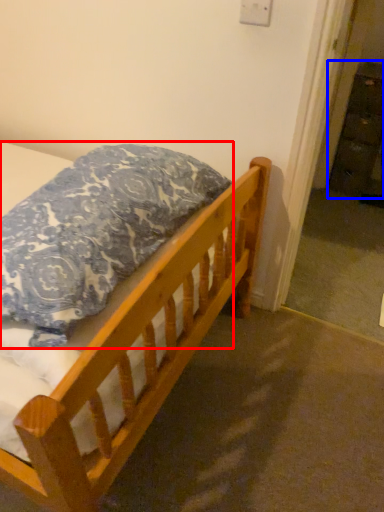
Question: Which point is further to the camera, pillow (highlighted by a red box) or dresser (highlighted by a blue box)?

Choices:
 (A) pillow
 (B) dresser

Answer: (B)